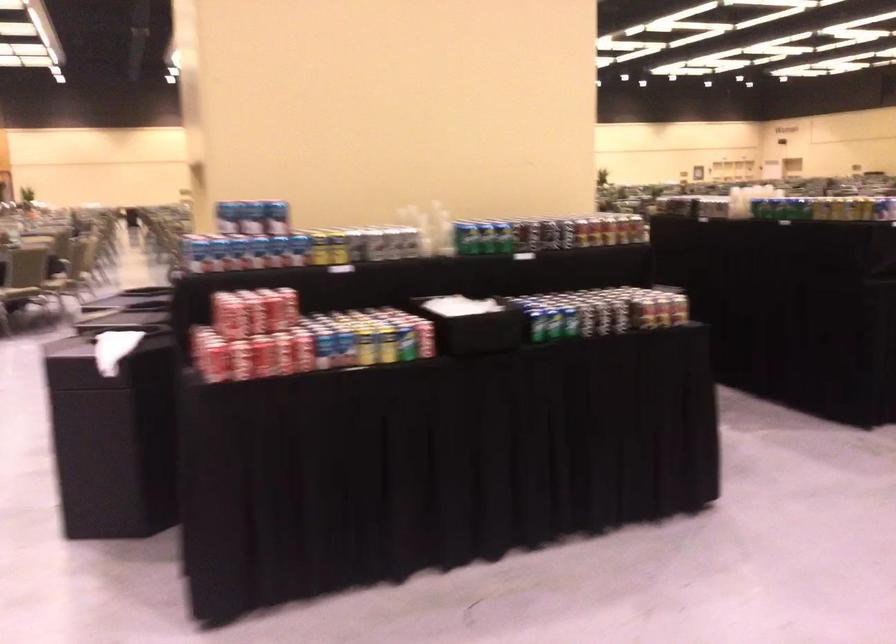
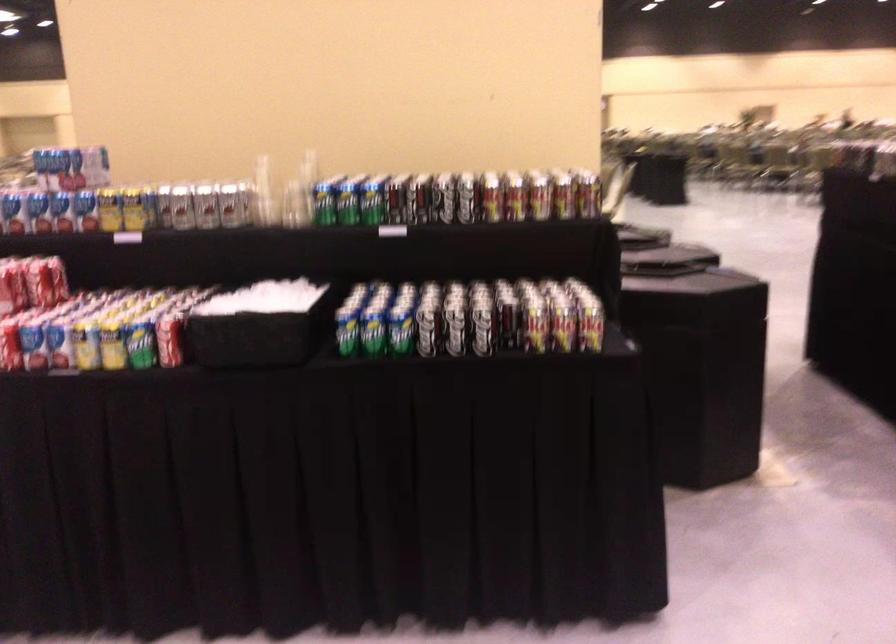
The point at (536, 328) is marked in the first image. Where is the corresponding point in the second image?

(347, 337)